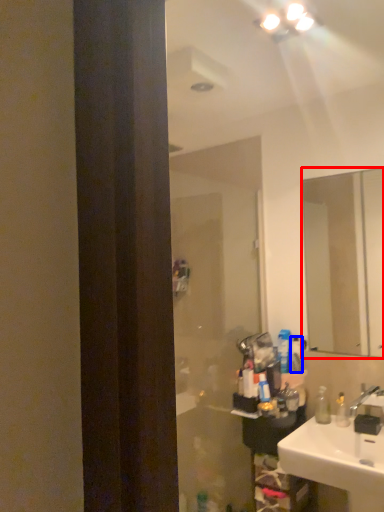
Question: Which object is further to the camera taking this photo, mirror (highlighted by a red box) or toiletry (highlighted by a blue box)?

Choices:
 (A) mirror
 (B) toiletry

Answer: (B)